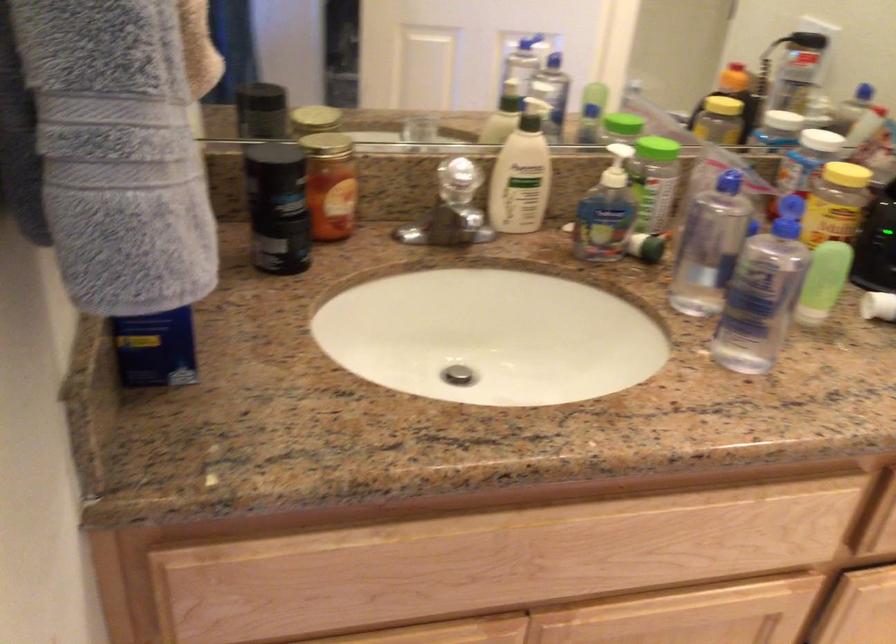
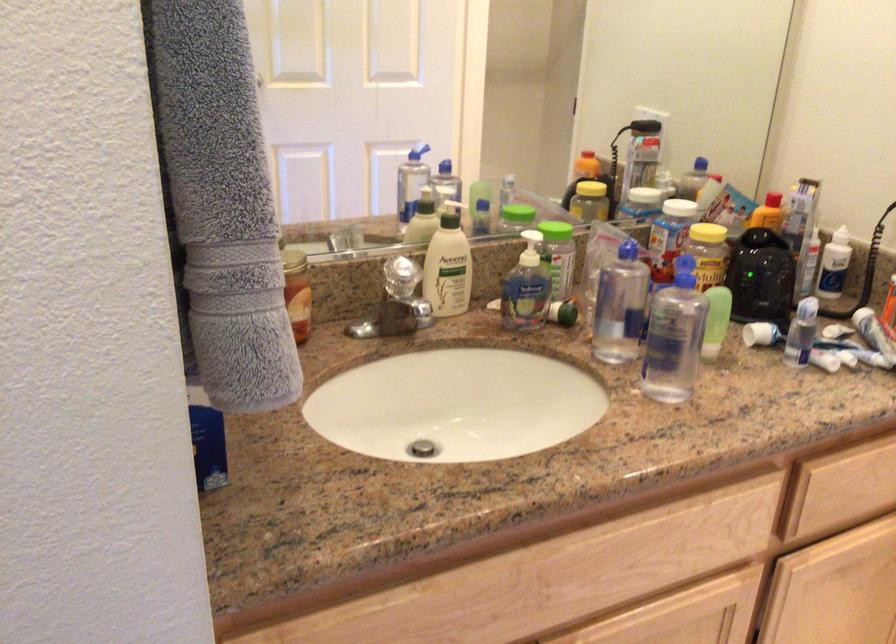
Where in the second image is the point corresponding to (x=519, y=176) from the first image?

(448, 265)